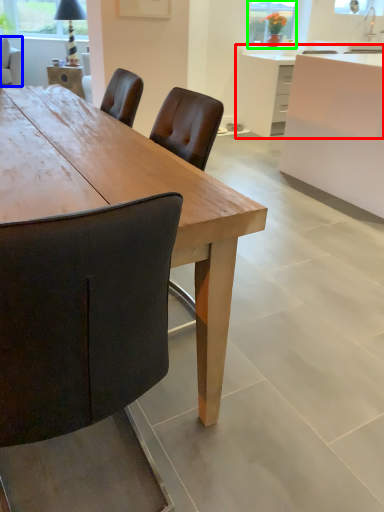
Question: Based on their relative distances, which object is nearer to counter (highlighted by a red box)? Choose from chair (highlighted by a blue box) and window screen (highlighted by a green box).

Choices:
 (A) chair
 (B) window screen

Answer: (B)